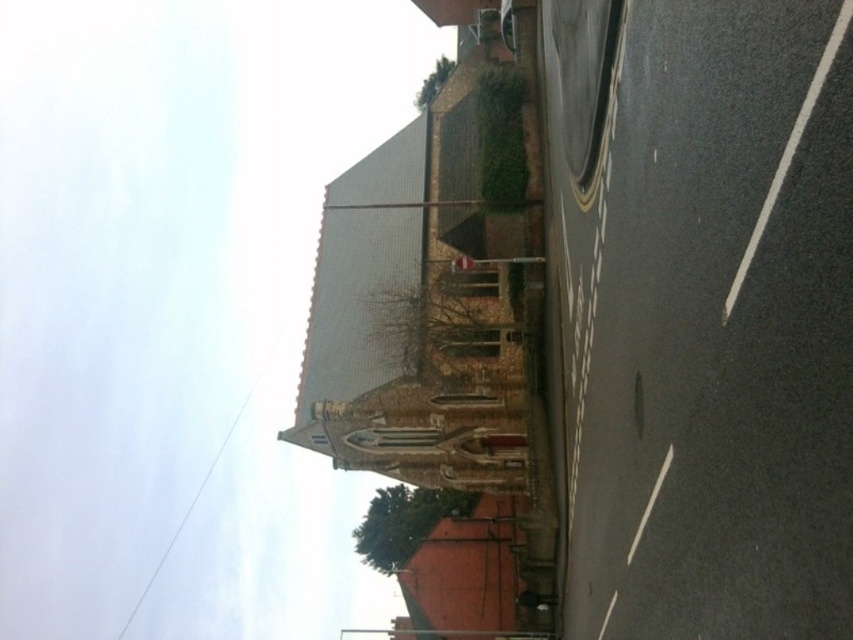
Is black asphalt at lower right positioned behind brown brick fire escape at center?

No, it is not.

Can you confirm if black asphalt at lower right is bigger than brown brick fire escape at center?

Incorrect, black asphalt at lower right is not larger than brown brick fire escape at center.

Who is more forward, (616, 582) or (357, 376)?

Positioned in front is point (616, 582).

Identify the location of black asphalt at lower right. Image resolution: width=853 pixels, height=640 pixels. (708, 323).